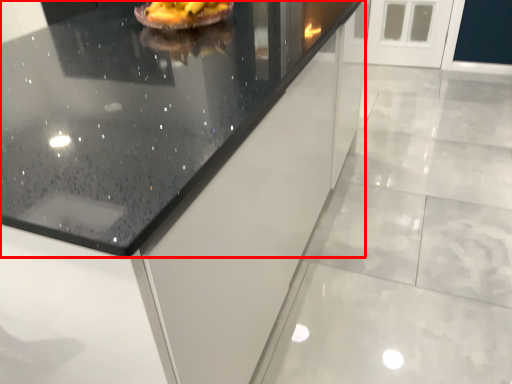
Question: From the image's perspective, where is countertop (annotated by the red box) located relative to food?

Choices:
 (A) above
 (B) below

Answer: (B)